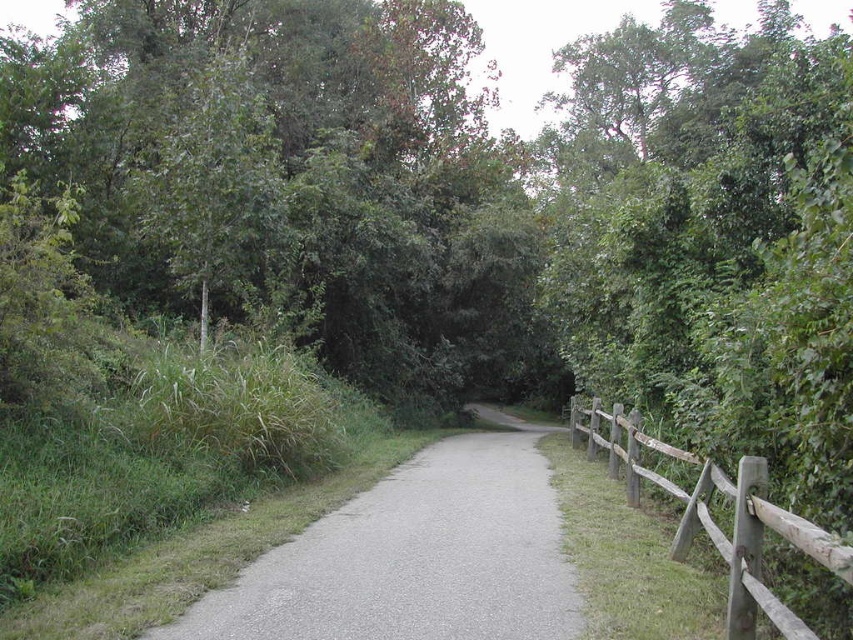
You are a hiker trying to decide whether to take a photo of the green leafy tree at upper left and the gray asphalt trail at center. Which object should you focus on if you want to capture something that is taller?

The green leafy tree at upper left is taller than the gray asphalt trail at center, so you should focus on the green leafy tree at upper left to capture something taller.